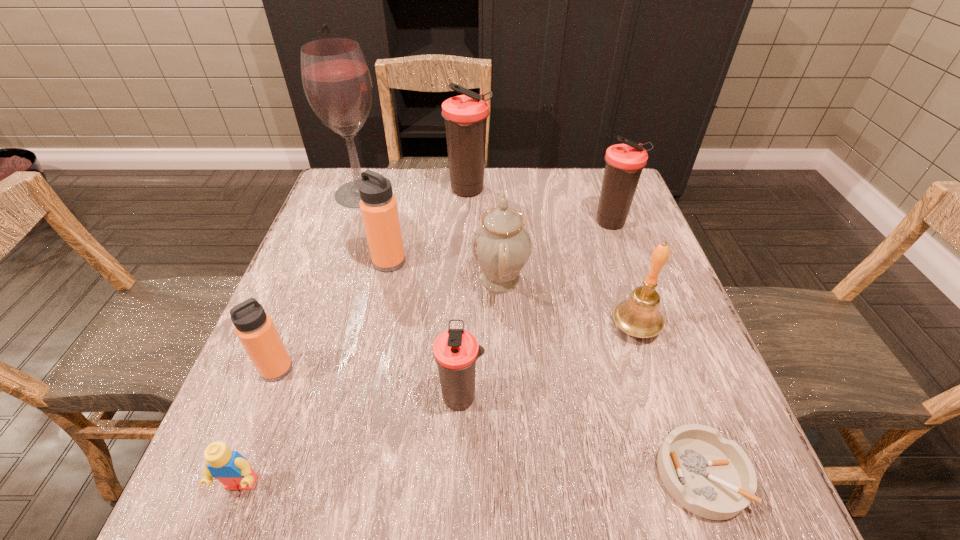
You are a GUI agent. You are given a task and a screenshot of the screen. Output one action in this format:
    pyautogui.click(x=<x>, y=<y>)
    Task: Click on the free space between the eighth nearest object and the bell
    
    Given the screenshot: What is the action you would take?
    pyautogui.click(x=624, y=275)

Locate an element on the screen. empty space between the bell and the tallest thermos bottle is located at coordinates (552, 259).

This screenshot has width=960, height=540. What are the coordinates of `vacant point located between the ashtray and the right orange thermos bottle` in the screenshot? It's located at (545, 368).

The image size is (960, 540). Find the location of `vacant region between the nearest brown thermos bottle and the ninth tallest object`. vacant region between the nearest brown thermos bottle and the ninth tallest object is located at coordinates (351, 441).

You are a GUI agent. You are given a task and a screenshot of the screen. Output one action in this format:
    pyautogui.click(x=<x>, y=<y>)
    Task: Click on the object identified as the eighth closest to the ashtray
    The image size is (960, 540).
    Given the screenshot: What is the action you would take?
    pyautogui.click(x=465, y=115)

I want to click on object that can be found as the third closest to the biggest brown thermos bottle, so click(379, 210).

Locate which thermos bottle ranks fourth in proximity to the Lego. Please provide its 2D coordinates. Your answer should be formatted as a tuple, i.e. [(x, y)], where the tuple contains the x and y coordinates of a point satisfying the conditions above.

[(465, 115)]

At what (x,y) coordinates should I click in order to perform the action: click on thermos bottle identified as the closest to the shortest object. Please return your answer as a coordinate pair (x, y). Image resolution: width=960 pixels, height=540 pixels. Looking at the image, I should click on (455, 351).

Locate an element on the screen. The height and width of the screenshot is (540, 960). brown thermos bottle that is the closest to the farther orange thermos bottle is located at coordinates (465, 115).

Choose which brown thermos bottle is the second nearest neighbor to the nearer orange thermos bottle. Please provide its 2D coordinates. Your answer should be formatted as a tuple, i.e. [(x, y)], where the tuple contains the x and y coordinates of a point satisfying the conditions above.

[(465, 115)]